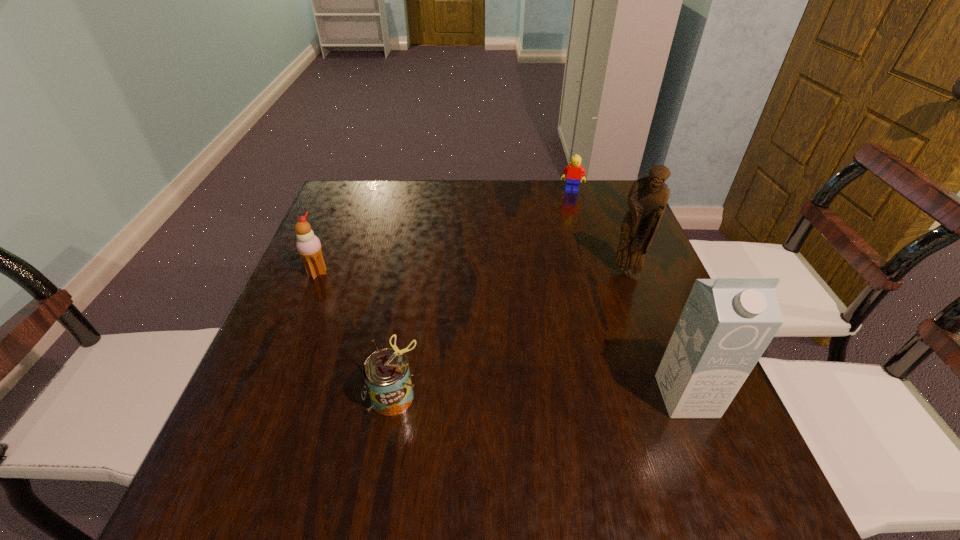
I want to click on free space located 0.060m on the front-facing side of the figurine, so click(610, 295).

Identify the location of vacant space positioned 0.380m at the front with a straw on the icecream. The height and width of the screenshot is (540, 960). (452, 338).

Image resolution: width=960 pixels, height=540 pixels. What are the coordinates of `free space located 0.190m at the front with a straw on the icecream` in the screenshot? It's located at (384, 306).

Where is `vacant space located 0.360m at the front with a straw on the icecream`? This screenshot has height=540, width=960. vacant space located 0.360m at the front with a straw on the icecream is located at coordinates coord(444,335).

This screenshot has width=960, height=540. Find the location of `blank space located 0.230m on the front-facing side of the shortest object`. blank space located 0.230m on the front-facing side of the shortest object is located at coordinates (564, 236).

Locate an element on the screen. The height and width of the screenshot is (540, 960). free space located on the front-facing side of the shortest object is located at coordinates (564, 226).

The width and height of the screenshot is (960, 540). I want to click on vacant point located on the front-facing side of the shortest object, so click(x=562, y=247).

What are the coordinates of `object that is at the far edge` in the screenshot? It's located at (572, 173).

Where is `can positioned at the near edge`? This screenshot has width=960, height=540. can positioned at the near edge is located at coordinates (386, 374).

Find the location of a particular element. Image resolution: width=960 pixels, height=540 pixels. carton positioned at the near edge is located at coordinates (727, 323).